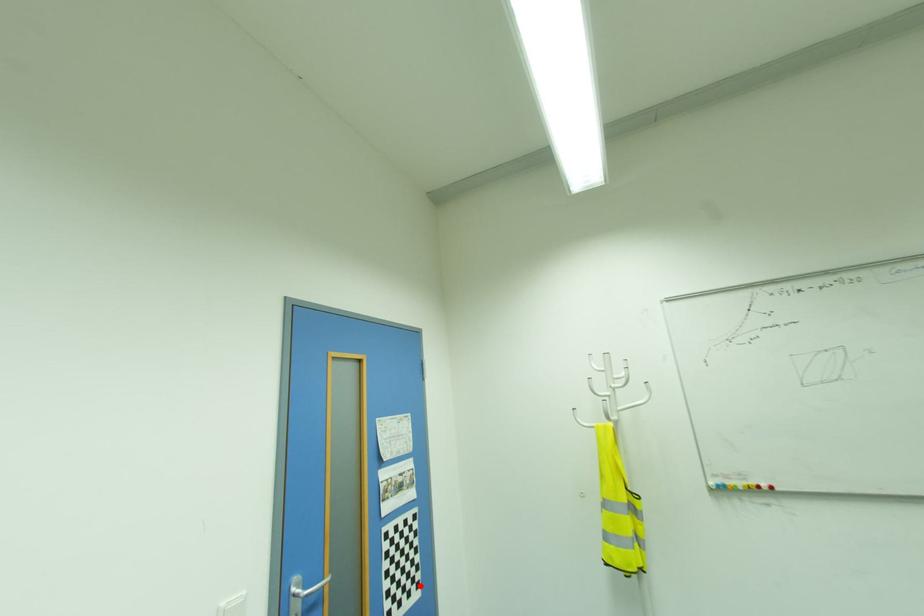
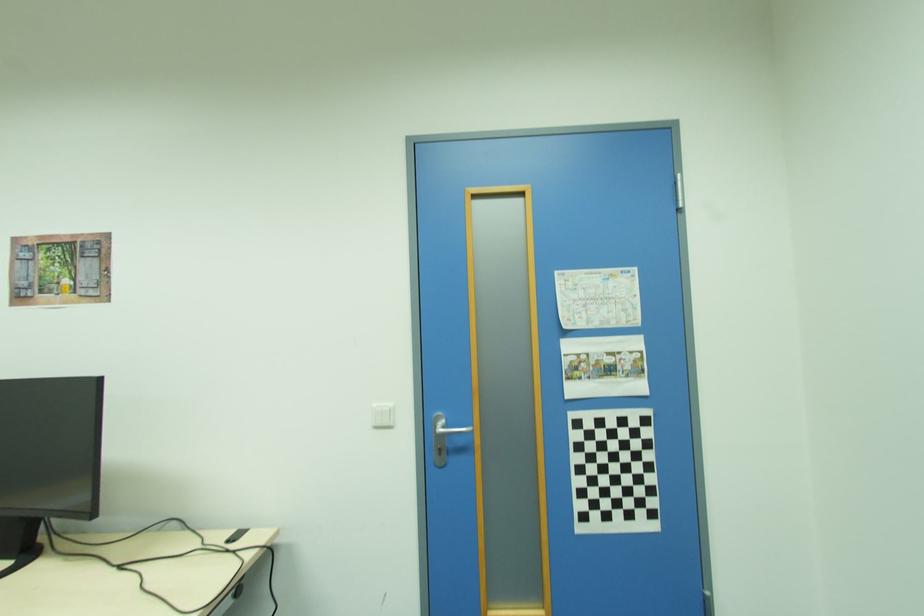
Locate, in the second image, the point that corresponds to the highlighted location in the first image.

(655, 515)